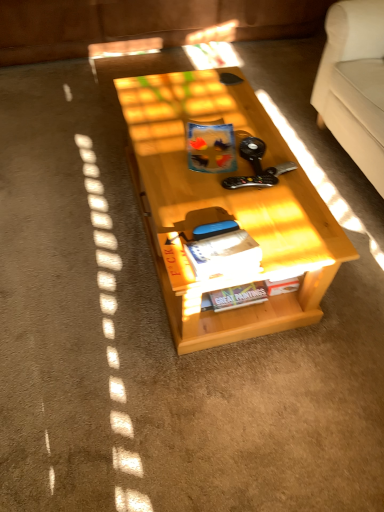
This screenshot has width=384, height=512. Identify the location of free space above hardcover book at center, positioned as the 1th book in back-to-front order (from a real-world perspective). pos(244,291).